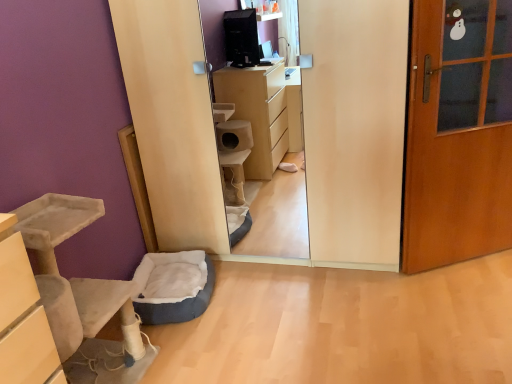
Question: Is beige suede cat tree at lower left inside blue fabric pet bed at lower left?

Choices:
 (A) yes
 (B) no

Answer: (B)

Question: From the image's perspective, is blue fabric pet bed at lower left on top of beige suede cat tree at lower left?

Choices:
 (A) no
 (B) yes

Answer: (A)

Question: Considering the relative positions of blue fabric pet bed at lower left and beige suede cat tree at lower left in the image provided, is blue fabric pet bed at lower left behind beige suede cat tree at lower left?

Choices:
 (A) no
 (B) yes

Answer: (B)

Question: Considering the relative sizes of blue fabric pet bed at lower left and beige suede cat tree at lower left in the image provided, is blue fabric pet bed at lower left taller than beige suede cat tree at lower left?

Choices:
 (A) no
 (B) yes

Answer: (A)

Question: Is blue fabric pet bed at lower left at the right side of beige suede cat tree at lower left?

Choices:
 (A) yes
 (B) no

Answer: (A)

Question: Is blue fabric pet bed at lower left completely or partially outside of beige suede cat tree at lower left?

Choices:
 (A) no
 (B) yes

Answer: (B)

Question: Considering the relative sizes of blue fabric pet bed at lower left and wooden door at right in the image provided, is blue fabric pet bed at lower left smaller than wooden door at right?

Choices:
 (A) no
 (B) yes

Answer: (B)

Question: Are blue fabric pet bed at lower left and wooden door at right beside each other?

Choices:
 (A) yes
 (B) no

Answer: (B)

Question: Considering the relative sizes of blue fabric pet bed at lower left and wooden door at right in the image provided, is blue fabric pet bed at lower left shorter than wooden door at right?

Choices:
 (A) no
 (B) yes

Answer: (B)

Question: Does blue fabric pet bed at lower left have a larger size compared to wooden door at right?

Choices:
 (A) no
 (B) yes

Answer: (A)

Question: From a real-world perspective, is blue fabric pet bed at lower left over wooden door at right?

Choices:
 (A) no
 (B) yes

Answer: (A)

Question: Is blue fabric pet bed at lower left located outside wooden door at right?

Choices:
 (A) yes
 (B) no

Answer: (A)

Question: Could you tell me if beige suede cat tree at lower left is turned towards wooden door at right?

Choices:
 (A) yes
 (B) no

Answer: (B)